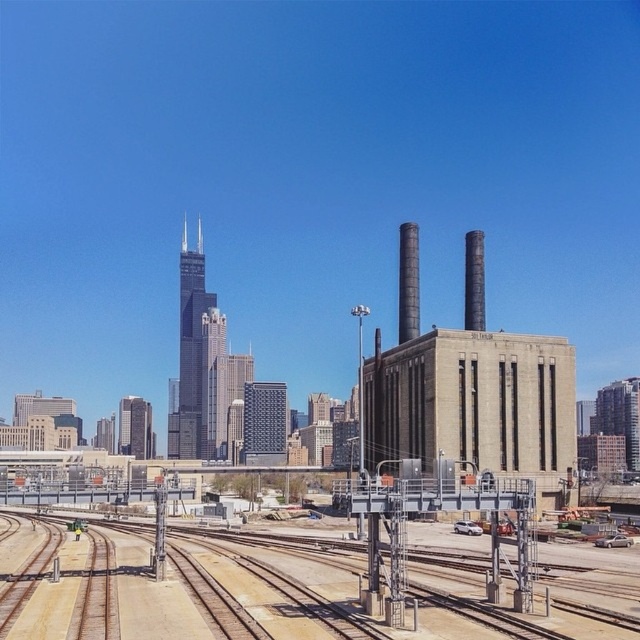
You are a photographer positioned at the edge of the rail yard. You want to take a photo that includes both the brown wooden track at lower center and the metallic gray power station at center. Based on their positions, which object will appear closer to the camera in the photo?

The brown wooden track at lower center appears closer to the camera because it is positioned in front of the metallic gray power station at center.

You are a maintenance worker needing to access the brown wooden track at lower center for repairs. The metallic gray power station at center is directly above it. Is the track accessible for inspection without moving the power station?

The brown wooden track at lower center is positioned under the metallic gray power station at center, so the track cannot be accessed for inspection without moving or modifying the power station structure.

You are a railway engineer inspecting the layout of the urban rail yard. You need to determine the position of the brown wooden track at lower center relative to the metallic gray power station at center. Based on the scene, which side of the power station is the track located on?

The brown wooden track at lower center is positioned to the left of the metallic gray power station at center.